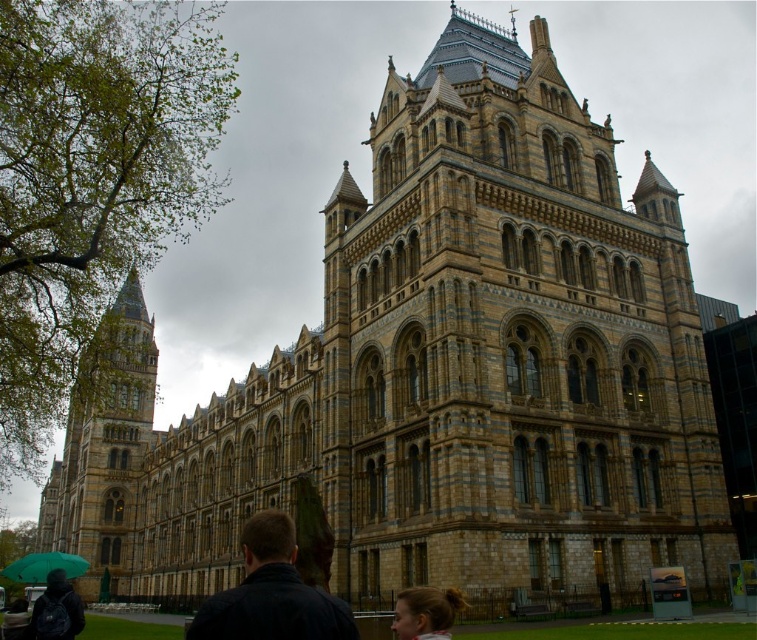
Question: Which point appears closest to the camera in this image?

Choices:
 (A) (430, 588)
 (B) (307, 637)

Answer: (B)

Question: Is dark blue jacket at lower center thinner than blonde hair at lower center?

Choices:
 (A) yes
 (B) no

Answer: (B)

Question: Which of the following is the farthest from the observer?

Choices:
 (A) dark blue jacket at lower center
 (B) dark blue backpack at lower left
 (C) brown stone tower at left
 (D) green matte umbrella at lower left

Answer: (C)

Question: Is blonde hair at lower center thinner than green matte umbrella at lower left?

Choices:
 (A) yes
 (B) no

Answer: (A)

Question: Which object appears farthest from the camera in this image?

Choices:
 (A) dark blue backpack at lower left
 (B) dark blue jacket at lower center
 (C) brown stone tower at left

Answer: (C)

Question: Is blonde hair at lower center thinner than green matte umbrella at lower left?

Choices:
 (A) no
 (B) yes

Answer: (B)